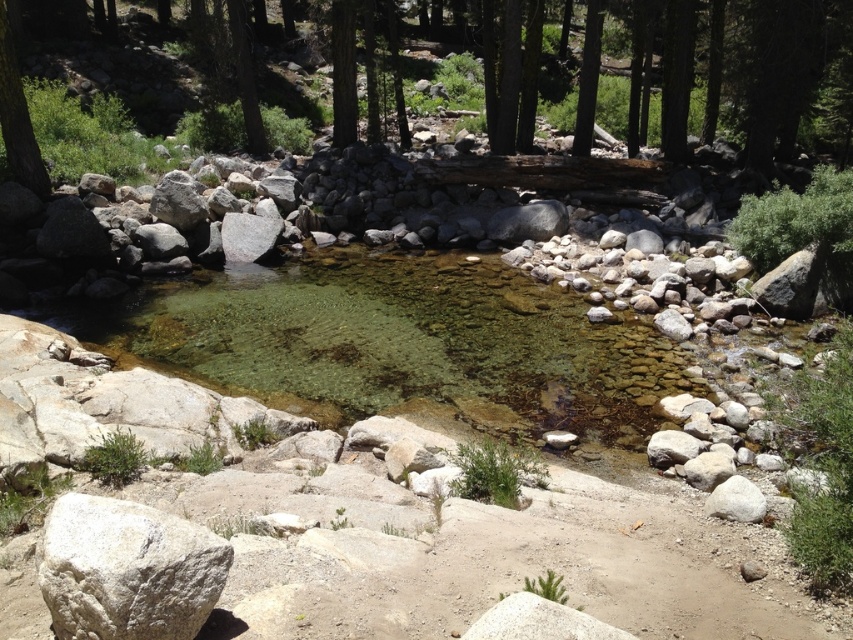
Question: Can you confirm if white rough boulder at lower left is positioned to the left of smooth bark tree at left?

Choices:
 (A) yes
 (B) no

Answer: (B)

Question: Can you confirm if white rough boulder at lower left is wider than smooth bark tree at left?

Choices:
 (A) yes
 (B) no

Answer: (B)

Question: Does white rough boulder at lower left appear on the left side of smooth bark tree at left?

Choices:
 (A) no
 (B) yes

Answer: (A)

Question: Which point is closer to the camera?

Choices:
 (A) smooth bark tree at left
 (B) white rough boulder at lower left

Answer: (B)

Question: Which point is farther from the camera taking this photo?

Choices:
 (A) tap(3, 76)
 (B) tap(62, 512)

Answer: (A)

Question: Which of the following is the farthest from the observer?

Choices:
 (A) (221, 552)
 (B) (21, 172)

Answer: (B)